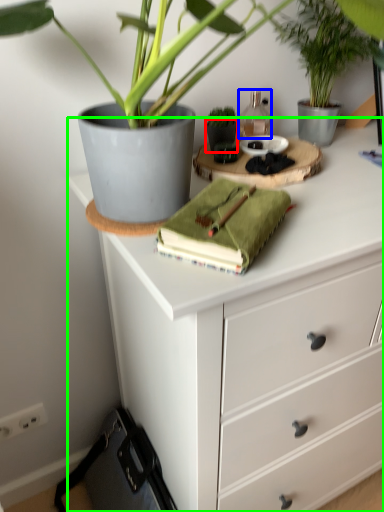
Question: Considering the real-world distances, which object is closest to flowerpot (highlighted by a red box)? bottle (highlighted by a blue box) or chest of drawers (highlighted by a green box).

Choices:
 (A) bottle
 (B) chest of drawers

Answer: (A)